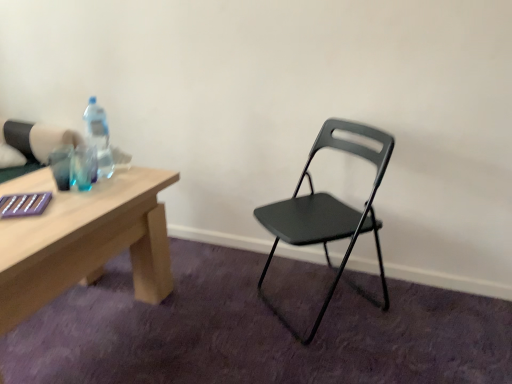
This screenshot has width=512, height=384. In order to click on matte black folding chair at center in this screenshot , I will do `click(328, 213)`.

What do you see at coordinates (328, 213) in the screenshot? I see `matte black folding chair at center` at bounding box center [328, 213].

Find the location of a particular element. translucent plastic bottle at table left is located at coordinates (99, 137).

Describe the element at coordinates (99, 137) in the screenshot. I see `translucent plastic bottle at table left` at that location.

Locate an element on the screen. matte black folding chair at center is located at coordinates (328, 213).

Is matte black folding chair at center to the left of translucent plastic bottle at table left from the viewer's perspective?

In fact, matte black folding chair at center is to the right of translucent plastic bottle at table left.

Is the position of matte black folding chair at center less distant than that of translucent plastic bottle at table left?

Yes.

Considering the positions of point (303, 219) and point (98, 113), is point (303, 219) closer or farther from the camera than point (98, 113)?

Point (303, 219) appears to be closer to the viewer than point (98, 113).

From the image's perspective, would you say matte black folding chair at center is positioned over translucent plastic bottle at table left?

Incorrect, from the image's perspective, matte black folding chair at center is lower than translucent plastic bottle at table left.

From a real-world perspective, between matte black folding chair at center and translucent plastic bottle at table left, who is vertically higher?

translucent plastic bottle at table left, from a real-world perspective.

Based on the photo, is matte black folding chair at center thinner than translucent plastic bottle at table left?

No.

Which of these two, matte black folding chair at center or translucent plastic bottle at table left, stands shorter?

With less height is translucent plastic bottle at table left.

Can you confirm if matte black folding chair at center is bigger than translucent plastic bottle at table left?

Yes.

Is matte black folding chair at center not within translucent plastic bottle at table left?

Yes, matte black folding chair at center is located beyond the bounds of translucent plastic bottle at table left.

Is there a large distance between matte black folding chair at center and translucent plastic bottle at table left?

No.

Could you tell me if matte black folding chair at center is facing translucent plastic bottle at table left?

No, matte black folding chair at center is not aimed at translucent plastic bottle at table left.

Where is `bottle above the matte black folding chair at center (from a real-world perspective)`? The width and height of the screenshot is (512, 384). bottle above the matte black folding chair at center (from a real-world perspective) is located at coordinates (99, 137).

Can you confirm if translucent plastic bottle at table left is positioned to the left of matte black folding chair at center?

Correct, you'll find translucent plastic bottle at table left to the left of matte black folding chair at center.

Which object is closer to the camera taking this photo, translucent plastic bottle at table left or matte black folding chair at center?

Positioned in front is matte black folding chair at center.

Considering the positions of point (101, 116) and point (353, 146), is point (101, 116) closer or farther from the camera than point (353, 146)?

Point (101, 116).

From the image's perspective, is translucent plastic bottle at table left above matte black folding chair at center?

Yes.

From a real-world perspective, is translucent plastic bottle at table left physically located above or below matte black folding chair at center?

translucent plastic bottle at table left is above matte black folding chair at center.

Which of these two, translucent plastic bottle at table left or matte black folding chair at center, is wider?

matte black folding chair at center is wider.

From their relative heights in the image, would you say translucent plastic bottle at table left is taller or shorter than matte black folding chair at center?

translucent plastic bottle at table left is shorter than matte black folding chair at center.

Considering the relative sizes of translucent plastic bottle at table left and matte black folding chair at center in the image provided, is translucent plastic bottle at table left smaller than matte black folding chair at center?

Correct, translucent plastic bottle at table left occupies less space than matte black folding chair at center.

Is matte black folding chair at center surrounded by translucent plastic bottle at table left?

No, matte black folding chair at center is located outside of translucent plastic bottle at table left.

Is translucent plastic bottle at table left placed right next to matte black folding chair at center?

No, translucent plastic bottle at table left is not next to matte black folding chair at center.

Is translucent plastic bottle at table left facing towards matte black folding chair at center?

Yes, translucent plastic bottle at table left is aimed at matte black folding chair at center.

Image resolution: width=512 pixels, height=384 pixels. What are the coordinates of `chair below the translucent plastic bottle at table left (from the image's perspective)` in the screenshot? It's located at (328, 213).

This screenshot has width=512, height=384. I want to click on bottle above the matte black folding chair at center (from a real-world perspective), so click(x=99, y=137).

Image resolution: width=512 pixels, height=384 pixels. I want to click on chair on the right of translucent plastic bottle at table left, so click(x=328, y=213).